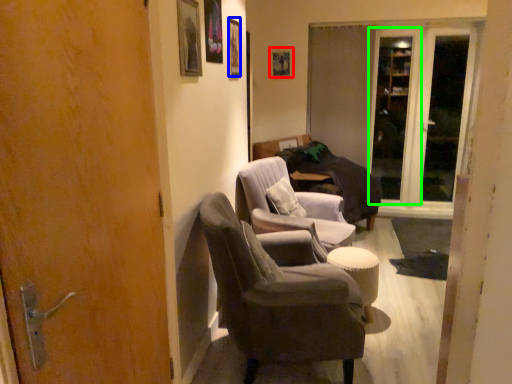
Question: Which object is positioned closest to picture frame (highlighted by a red box)? Select from picture frame (highlighted by a blue box) and screen door (highlighted by a green box).

Choices:
 (A) picture frame
 (B) screen door

Answer: (B)